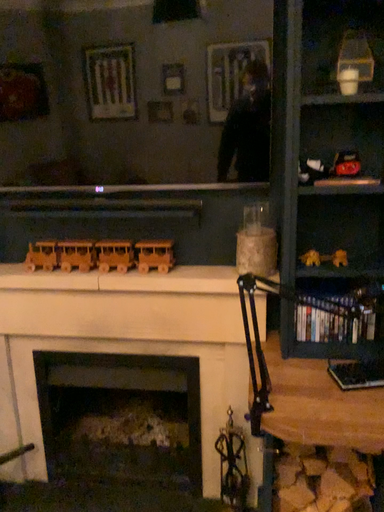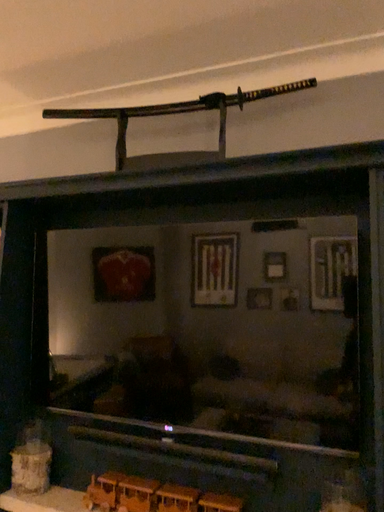
Question: How did the camera likely rotate when shooting the video?

Choices:
 (A) rotated upward
 (B) rotated downward

Answer: (A)